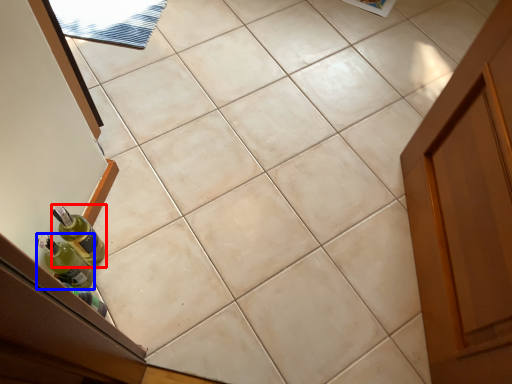
Question: Which object appears farthest to the camera in this image, bottle (highlighted by a red box) or bottle (highlighted by a blue box)?

Choices:
 (A) bottle
 (B) bottle

Answer: (A)